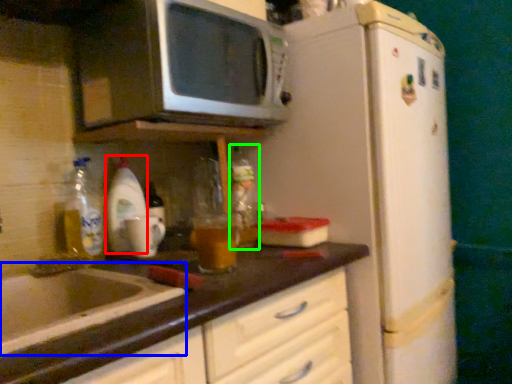
Question: Considering the real-world distances, which object is closest to beverage (highlighted by a red box)? sink (highlighted by a blue box) or bottle (highlighted by a green box).

Choices:
 (A) sink
 (B) bottle

Answer: (B)